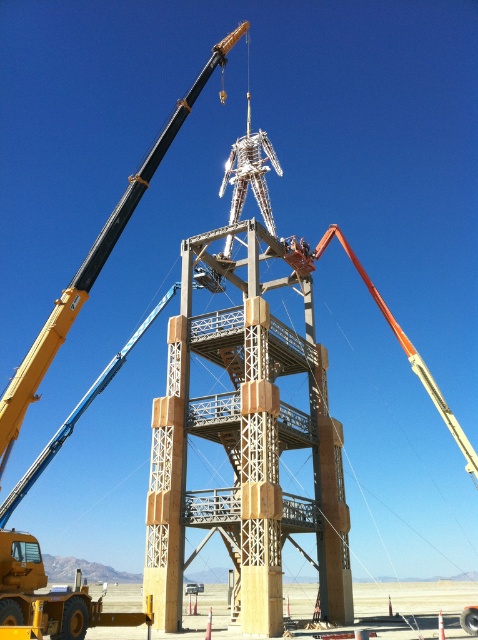
You are standing at the point marked as point (257, 240) on the construction site. You need to walk to the nearest crane. Which crane should you go to?

The nearest crane to point (257, 240) is the yellow crane with a black boom arm because it is closer to the point than the orange crane with a red boom arm.

Based on the photo, you are an engineer observing the construction site. You need to determine the spatial relationship between the brown wooden tower at center and the yellow metallic crane arm at upper left. Which object is positioned higher in the image?

The brown wooden tower at center is located below the yellow metallic crane arm at upper left, so the yellow metallic crane arm at upper left is positioned higher.

You are a construction worker standing at the edge of the construction site. You need to move a heavy equipment from your current position to the brown wooden tower at center. Given that the equipment requires a minimum of 50 meters of space to operate safely, can you safely operate the equipment to reach the tower?

The distance between the brown wooden tower at center and the camera is 48.14 meters. Since the equipment requires a minimum of 50 meters of space to operate safely, the distance is insufficient. Therefore, you cannot safely operate the equipment to reach the tower.